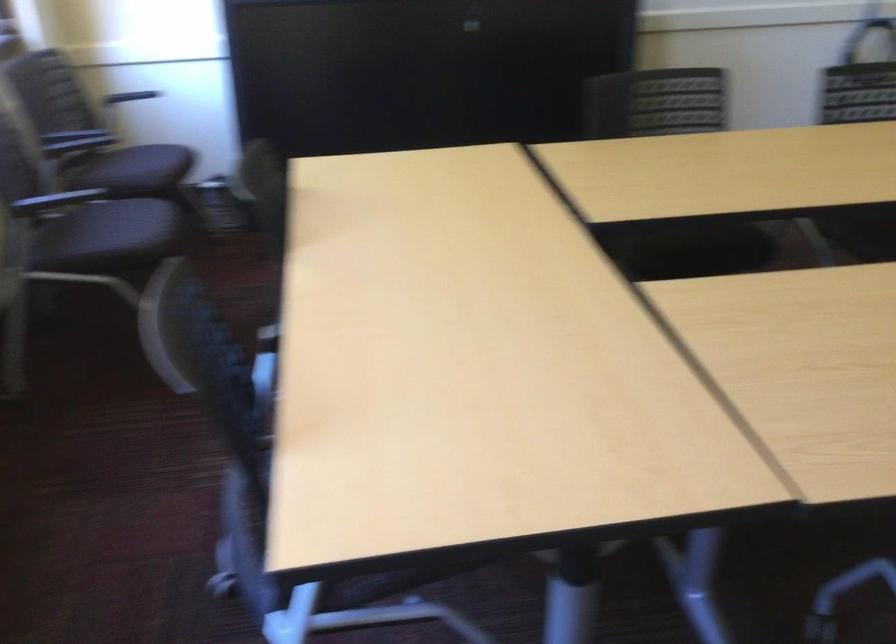
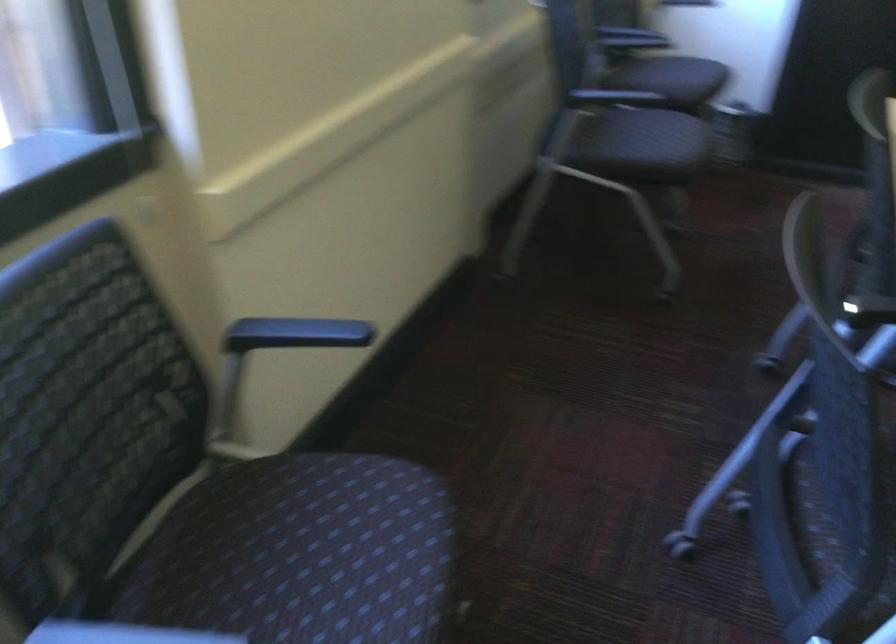
Question: The first image is from the beginning of the video and the second image is from the end. How did the camera likely rotate when shooting the video?

Choices:
 (A) Left
 (B) Right
 (C) Up
 (D) Down

Answer: (A)